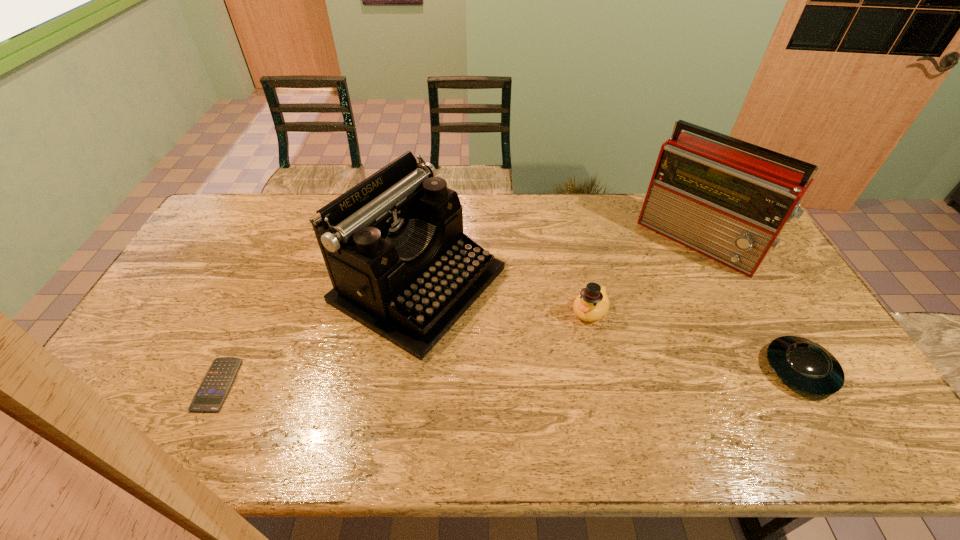
Identify the location of free point that satisfies the following two spatial constraints: 1. on the front side of the radio receiver; 2. on the left side of the second shortest object. coord(767,369).

Find the location of a particular element. This screenshot has width=960, height=540. vacant point that satisfies the following two spatial constraints: 1. on the front side of the typewriter; 2. on the right side of the saucer is located at coordinates (407, 369).

The image size is (960, 540). Identify the location of free space that satisfies the following two spatial constraints: 1. on the back side of the leftmost object; 2. on the left side of the radio receiver. (285, 239).